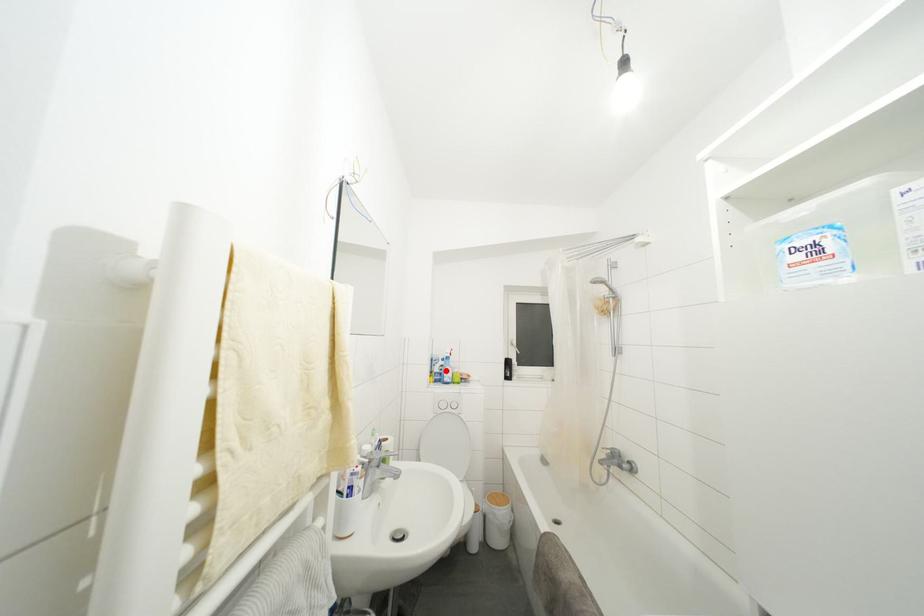
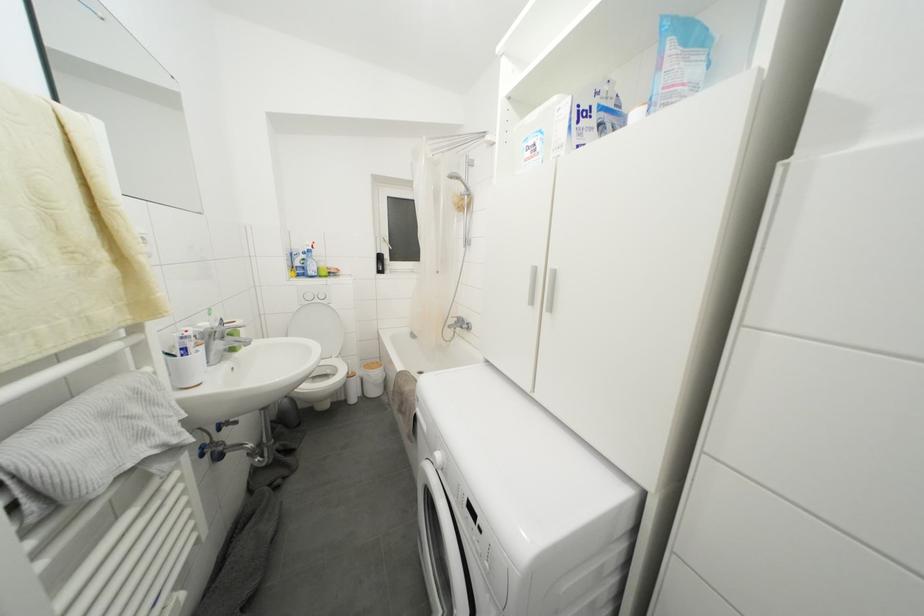
Question: I am providing you with two images of the same scene from different viewpoints. In image1, a red point is highlighted. Considering the same 3D point in image2, which of the following is correct?

Choices:
 (A) It is closer
 (B) It is farther

Answer: (A)